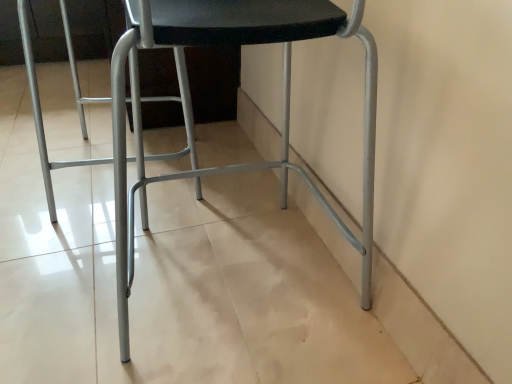
Where is `vacant space to the left of metallic gray chair at center`? The width and height of the screenshot is (512, 384). vacant space to the left of metallic gray chair at center is located at coordinates (64, 281).